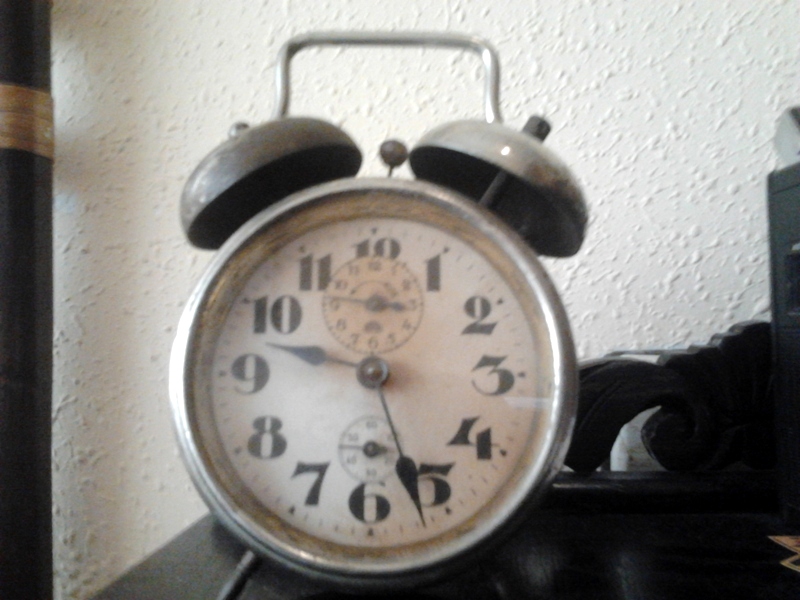
This screenshot has width=800, height=600. I want to click on nightstand, so click(x=178, y=581).